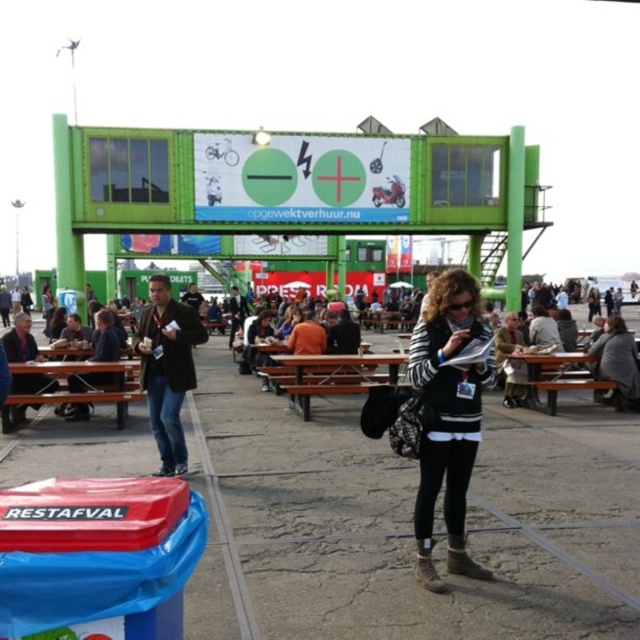
You are standing at the trash bin labeled RESTAFVAL in the foreground of the scene. You want to move towards the picnic tables in the midground. Which of the two points, point (147,336) or point (589,356), would you pass through first on your way to the picnic tables?

Point (147,336) is closer to the viewer than point (589,356), so you would pass through point (147,336) first on your way to the picnic tables.

You are trying to decide whether to place the dark brown leather jacket at center on top of the brown wooden bench at center. Based on their sizes, do you think it will fit?

The dark brown leather jacket at center is thinner than the brown wooden bench at center, so it should fit comfortably on top.

You are planning to sit down for a picnic and need to choose between the brown wooden bench at center and the brown wooden picnic table at lower right. Which one is higher from the ground?

The brown wooden bench at center is higher than the brown wooden picnic table at lower right because it is positioned above it in the image.